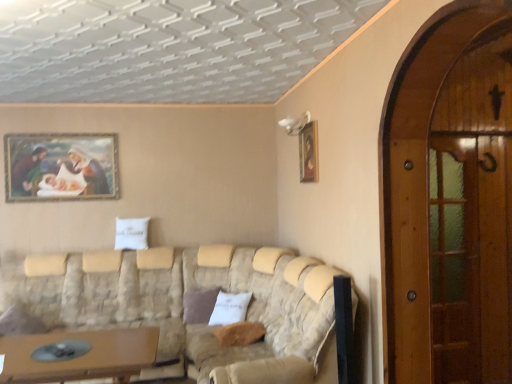
Question: Should I look upward or downward to see wooden screen door at right, placed as the 1th screen door when sorted from front to back?

Choices:
 (A) down
 (B) up

Answer: (A)

Question: Is brown fabric pillow at center, which appears as the second pillow when viewed from the front, shorter than brown plush pillow at center, the second pillow viewed from the back?

Choices:
 (A) yes
 (B) no

Answer: (B)

Question: Does brown fabric pillow at center, the 1th pillow positioned from the left, have a smaller size compared to brown plush pillow at center, the first pillow positioned from the front?

Choices:
 (A) no
 (B) yes

Answer: (A)

Question: Considering the relative positions of brown fabric pillow at center, the 1th pillow positioned from the left, and brown plush pillow at center, the 1th pillow positioned from the right, in the image provided, is brown fabric pillow at center, the 1th pillow positioned from the left, to the left of brown plush pillow at center, the 1th pillow positioned from the right, from the viewer's perspective?

Choices:
 (A) yes
 (B) no

Answer: (A)

Question: From a real-world perspective, is brown fabric pillow at center, which appears as the second pillow when viewed from the front, below brown plush pillow at center, the second pillow viewed from the back?

Choices:
 (A) no
 (B) yes

Answer: (A)

Question: Is brown fabric pillow at center, the first pillow positioned from the back, oriented towards brown plush pillow at center, the second pillow viewed from the back?

Choices:
 (A) yes
 (B) no

Answer: (A)

Question: Can you confirm if brown fabric pillow at center, marked as the 2th pillow in a right-to-left arrangement, is bigger than brown plush pillow at center, which is the second pillow from left to right?

Choices:
 (A) yes
 (B) no

Answer: (A)

Question: Does brown plush pillow at center, the second pillow viewed from the back, turn towards brown wooden table at lower left?

Choices:
 (A) yes
 (B) no

Answer: (A)

Question: From the image's perspective, is brown plush pillow at center, the second pillow viewed from the back, over brown wooden table at lower left?

Choices:
 (A) yes
 (B) no

Answer: (A)

Question: Can you confirm if brown plush pillow at center, which is the second pillow from left to right, is thinner than brown wooden table at lower left?

Choices:
 (A) yes
 (B) no

Answer: (A)

Question: Is brown wooden table at lower left at the back of brown plush pillow at center, the 1th pillow positioned from the right?

Choices:
 (A) no
 (B) yes

Answer: (A)

Question: Is brown plush pillow at center, which is the second pillow from left to right, wider than brown wooden table at lower left?

Choices:
 (A) no
 (B) yes

Answer: (A)

Question: Can you see brown plush pillow at center, the 1th pillow positioned from the right, touching brown wooden table at lower left?

Choices:
 (A) no
 (B) yes

Answer: (A)

Question: From a real-world perspective, is wooden screen door at right, the 2th screen door when ordered from right to left, positioned under brown fabric pillow at center, the 1th pillow positioned from the left, based on gravity?

Choices:
 (A) no
 (B) yes

Answer: (A)